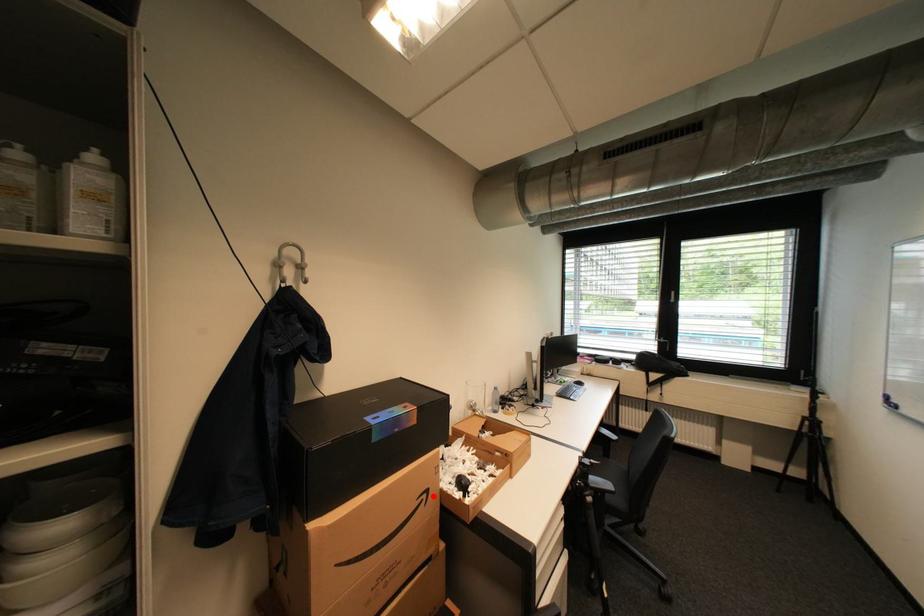
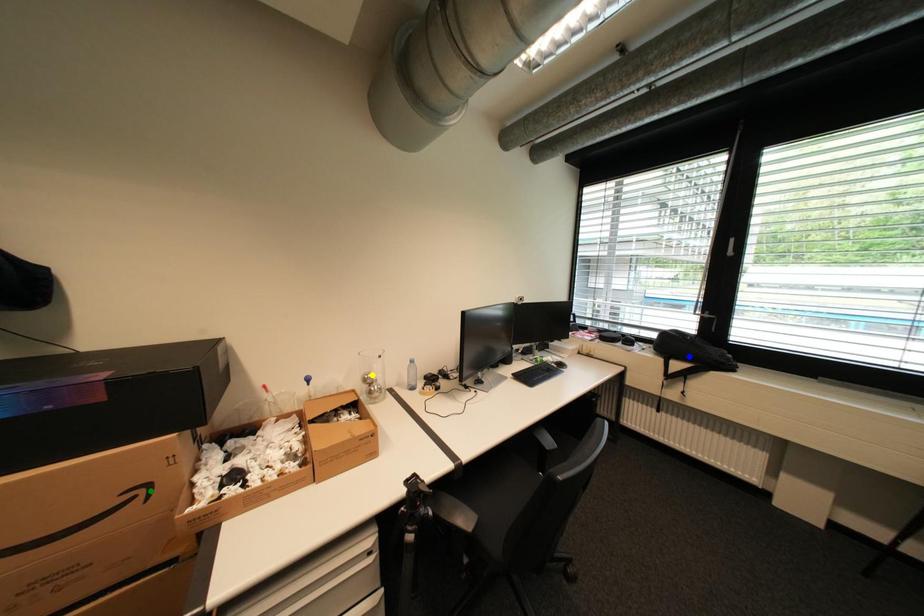
Question: I am providing you with two images of the same scene from different viewpoints. A red point is marked on the first image. You are given multiple points on the second image. Which mark in image 2 goes with the point in image 1?

Choices:
 (A) blue point
 (B) green point
 (C) yellow point

Answer: (B)